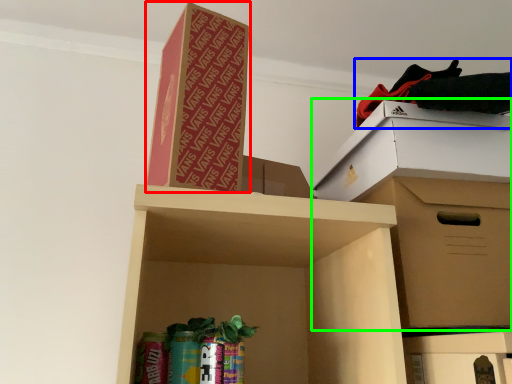
Question: Which object is positioned closest to cardboard box (highlighted by a red box)? Select from clothing (highlighted by a blue box) and cardboard box (highlighted by a green box).

Choices:
 (A) clothing
 (B) cardboard box

Answer: (A)